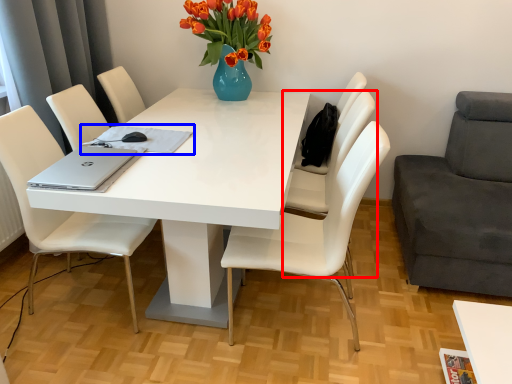
Question: Which object is further to the camera taking this photo, chair (highlighted by a red box) or notepad (highlighted by a blue box)?

Choices:
 (A) chair
 (B) notepad

Answer: (A)